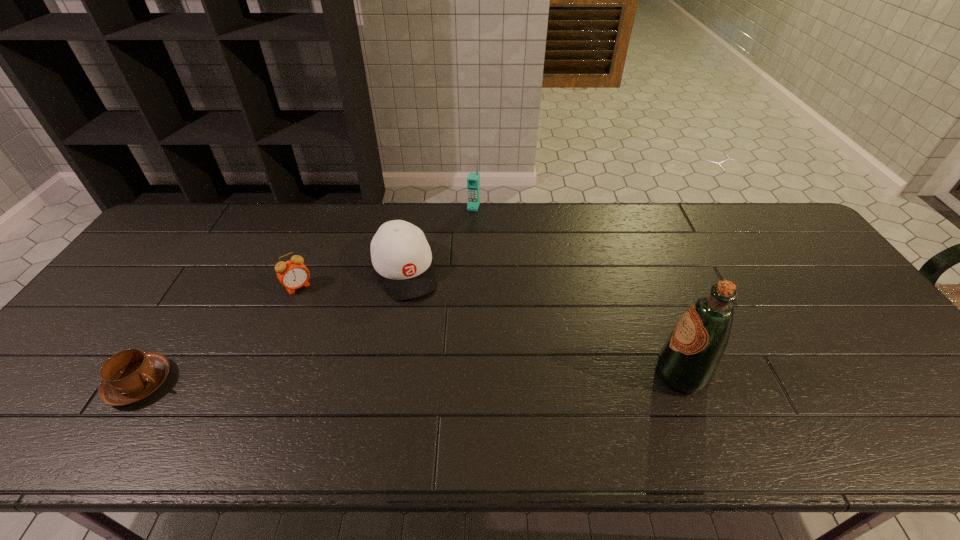
Where is `free region located on the front-facing side of the rightmost object`? Image resolution: width=960 pixels, height=540 pixels. free region located on the front-facing side of the rightmost object is located at coordinates (633, 375).

Where is `vacant region located on the front-facing side of the rightmost object`? This screenshot has height=540, width=960. vacant region located on the front-facing side of the rightmost object is located at coordinates (554, 375).

You are a GUI agent. You are given a task and a screenshot of the screen. Output one action in this format:
    pyautogui.click(x=<x>, y=<y>)
    Task: Click on the free spot located 0.190m on the face of the alarm clock
    Image resolution: width=960 pixels, height=540 pixels.
    Given the screenshot: What is the action you would take?
    pyautogui.click(x=334, y=335)

Where is `vacant space located on the face of the alarm clock`? vacant space located on the face of the alarm clock is located at coordinates [329, 328].

This screenshot has width=960, height=540. Identify the location of free spot located on the face of the alarm clock. (348, 355).

The width and height of the screenshot is (960, 540). Identify the location of free location located on the front-facing side of the third object from left to right. (456, 401).

Where is `free space located on the front-facing side of the third object from left to right`? This screenshot has width=960, height=540. free space located on the front-facing side of the third object from left to right is located at coordinates (420, 315).

At what (x,y) coordinates should I click in order to perform the action: click on free space located 0.110m on the front-facing side of the third object from left to right. Please return your answer as a coordinate pair (x, y). Looking at the image, I should click on (x=425, y=328).

Where is `vacant position located on the keypad of the fourth shortest object`? The height and width of the screenshot is (540, 960). vacant position located on the keypad of the fourth shortest object is located at coordinates (468, 222).

Find the location of a particular element. Image resolution: width=960 pixels, height=540 pixels. vacant space located 0.230m on the keypad of the fourth shortest object is located at coordinates (457, 254).